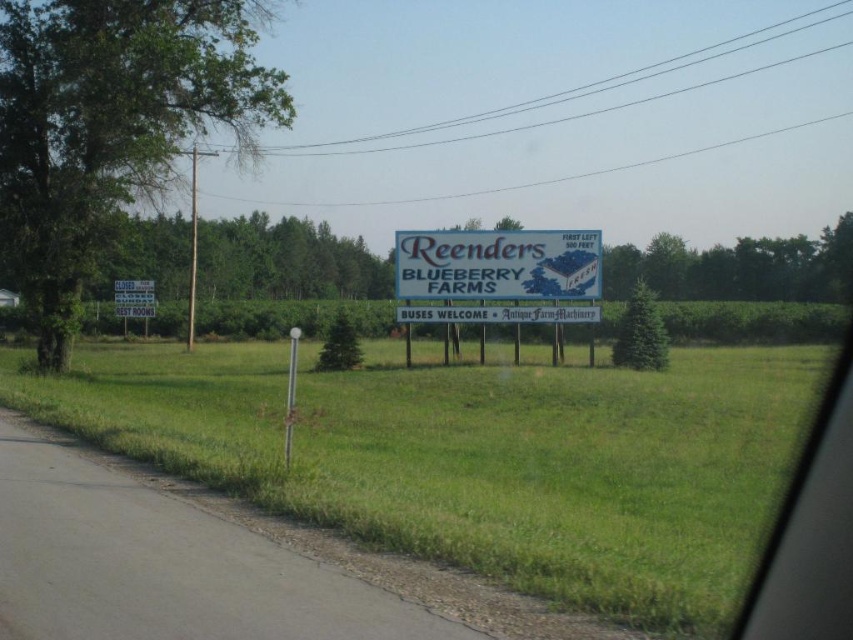
Question: Can you confirm if transparent glass car window at center is positioned below white plastic sign at center?

Choices:
 (A) no
 (B) yes

Answer: (B)

Question: Which object appears closest to the camera in this image?

Choices:
 (A) white plastic sign at center
 (B) transparent glass car window at center

Answer: (B)

Question: Is transparent glass car window at center above white plastic sign at center?

Choices:
 (A) no
 (B) yes

Answer: (A)

Question: Which point is farther to the camera?

Choices:
 (A) white plastic sign at center
 (B) transparent glass car window at center

Answer: (A)

Question: Does transparent glass car window at center have a larger size compared to white plastic sign at center?

Choices:
 (A) no
 (B) yes

Answer: (A)